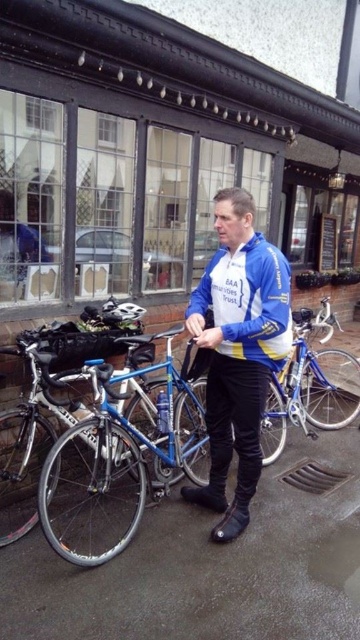
Who is lower down, shiny blue frame at center or shiny silver bicycle at left?

Positioned lower is shiny blue frame at center.

Does shiny blue frame at center appear on the right side of shiny silver bicycle at left?

Correct, you'll find shiny blue frame at center to the right of shiny silver bicycle at left.

Is point (79, 467) less distant than point (0, 481)?

No.

Locate an element on the screen. The image size is (360, 640). shiny blue frame at center is located at coordinates (110, 465).

Is blue fabric jacket at center to the right of shiny blue frame at center from the viewer's perspective?

Yes, blue fabric jacket at center is to the right of shiny blue frame at center.

In the scene shown: Which of these two, blue fabric jacket at center or shiny blue frame at center, stands shorter?

Standing shorter between the two is shiny blue frame at center.

Is point (219, 369) closer to viewer compared to point (48, 476)?

No, (219, 369) is behind (48, 476).

Identify the location of blue fabric jacket at center. This screenshot has height=640, width=360. (239, 342).

Which of these two, blue fabric jacket at center or shiny silver bicycle at left, stands shorter?

shiny silver bicycle at left

Who is lower down, blue fabric jacket at center or shiny silver bicycle at left?

Positioned lower is shiny silver bicycle at left.

Which is behind, point (277, 368) or point (25, 499)?

The point (25, 499) is behind.

Locate an element on the screen. blue fabric jacket at center is located at coordinates (239, 342).